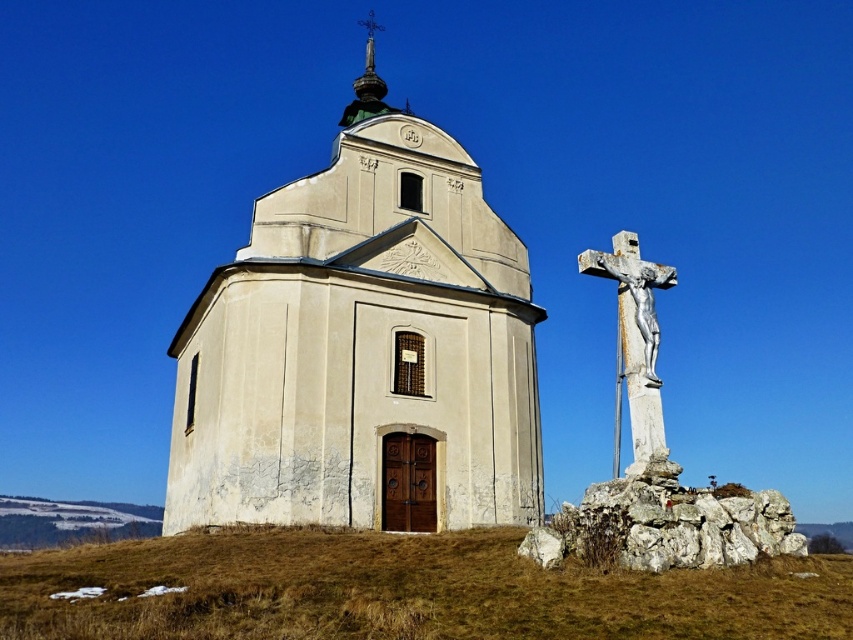
You are a photographer standing in front of the beige stone church at center and the white stone crucifix at right. You want to take a photo that includes both objects in the frame. Which object should be placed closer to the camera to ensure both are fully visible?

The white stone crucifix at right is behind the beige stone church at center, so to include both in the frame, the photographer should position themselves so that the beige stone church at center is closer to the camera. This way, the crucifix behind it will also be in the background of the photo.